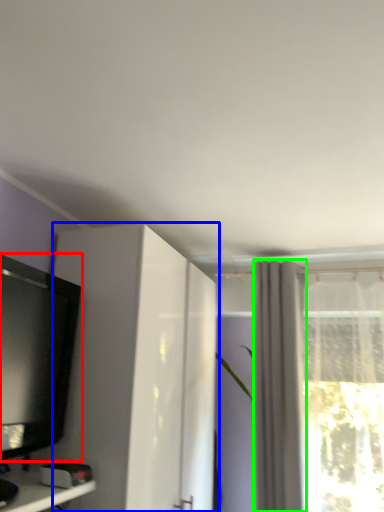
Question: Which is farther away from television (highlighted by a red box)? cabinetry (highlighted by a blue box) or curtain (highlighted by a green box)?

Choices:
 (A) cabinetry
 (B) curtain

Answer: (B)